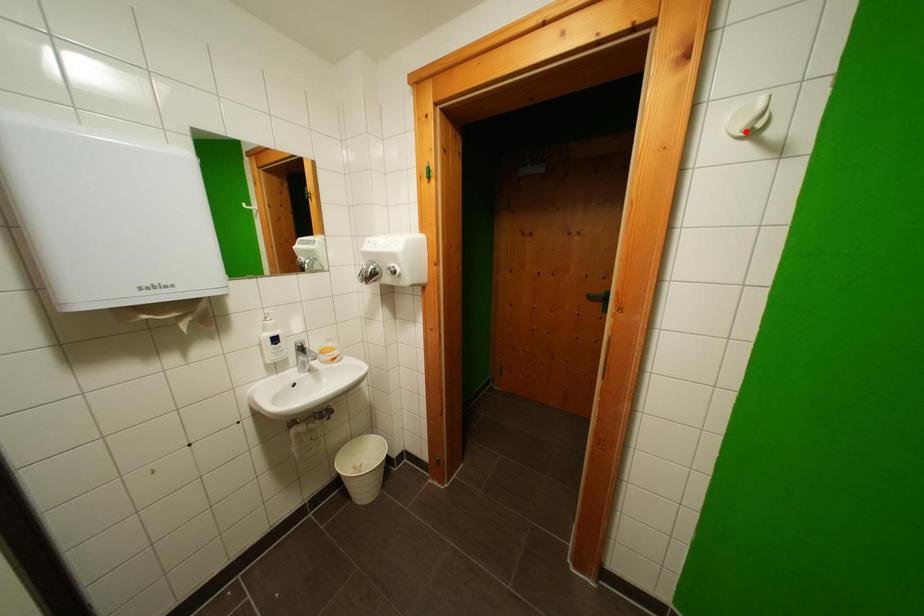
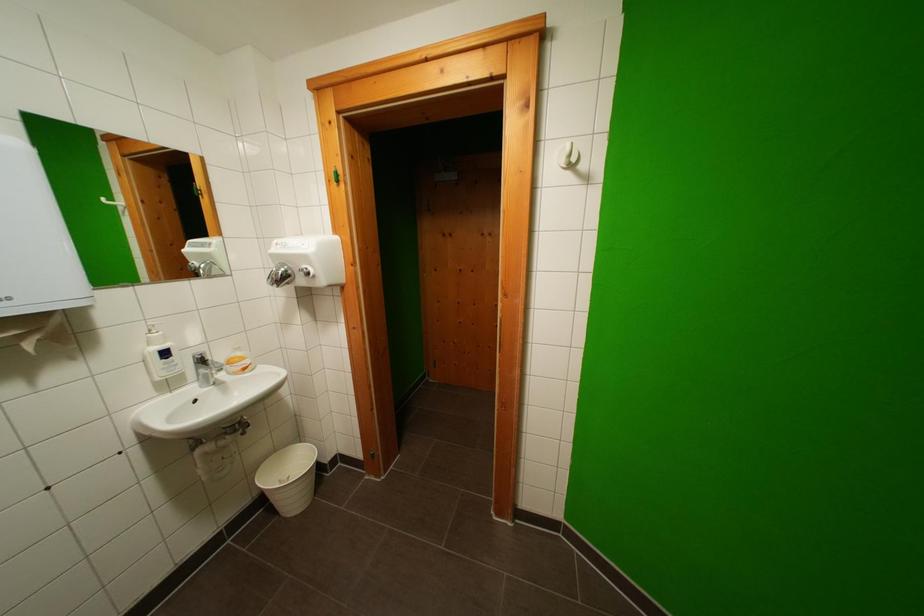
The point at the highlighted location is marked in the first image. Where is the corresponding point in the second image?

(569, 164)